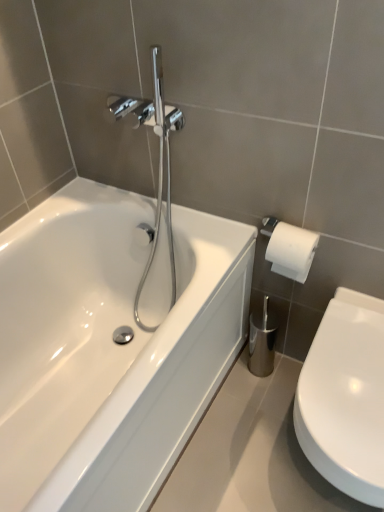
Question: From the image's perspective, relative to white glossy toilet at lower right, is white glossy bathtub at left above or below?

Choices:
 (A) above
 (B) below

Answer: (A)

Question: Considering the positions of white glossy bathtub at left and white glossy toilet at lower right in the image, is white glossy bathtub at left wider or thinner than white glossy toilet at lower right?

Choices:
 (A) wide
 (B) thin

Answer: (A)

Question: From a real-world perspective, is white glossy bathtub at left above or below white glossy toilet at lower right?

Choices:
 (A) below
 (B) above

Answer: (B)

Question: From a real-world perspective, relative to white glossy bathtub at left, is white glossy toilet at lower right vertically above or below?

Choices:
 (A) below
 (B) above

Answer: (A)

Question: Is white glossy toilet at lower right wider or thinner than white glossy bathtub at left?

Choices:
 (A) thin
 (B) wide

Answer: (A)

Question: Do you think white glossy toilet at lower right is within white glossy bathtub at left, or outside of it?

Choices:
 (A) inside
 (B) outside

Answer: (B)

Question: Based on their sizes in the image, would you say white glossy toilet at lower right is bigger or smaller than white glossy bathtub at left?

Choices:
 (A) small
 (B) big

Answer: (A)